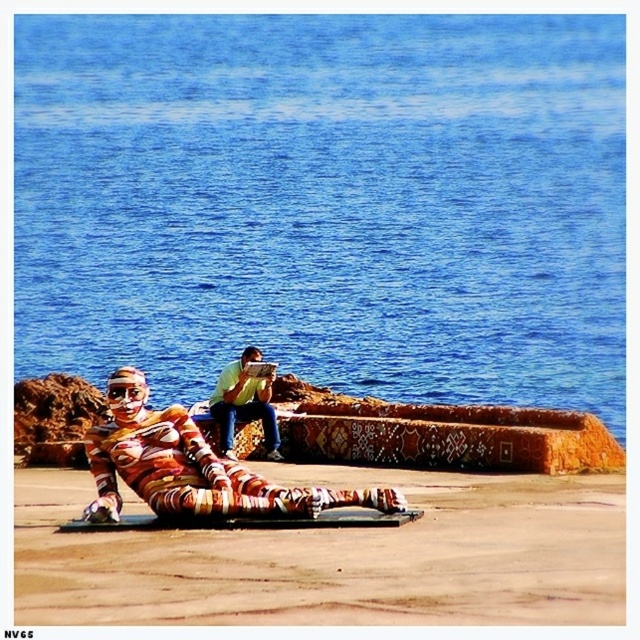
Question: Which is farther from the translucent plastic goggles at lower left?

Choices:
 (A) yellow-green t-shirt at center
 (B) blue water at upper center
 (C) multicolored fabric figure at lower center
 (D) smooth tan sand at lower center

Answer: (B)

Question: Can you confirm if smooth tan sand at lower center is positioned above multicolored fabric figure at lower center?

Choices:
 (A) no
 (B) yes

Answer: (A)

Question: Can you confirm if multicolored fabric figure at lower center is wider than yellow-green t-shirt at center?

Choices:
 (A) yes
 (B) no

Answer: (A)

Question: Among these points, which one is farthest from the camera?

Choices:
 (A) (352, 385)
 (B) (214, 388)
 (C) (122, 390)

Answer: (B)

Question: From the image, what is the correct spatial relationship of yellow-green t-shirt at center in relation to translucent plastic goggles at lower left?

Choices:
 (A) below
 (B) above

Answer: (A)

Question: Which point is closer to the camera?

Choices:
 (A) blue water at upper center
 (B) smooth tan sand at lower center

Answer: (B)